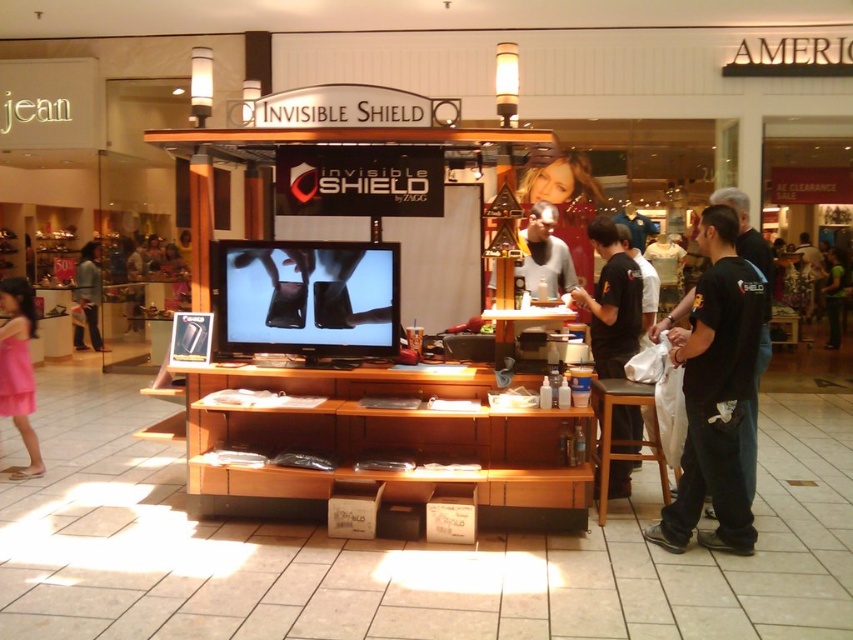
You are a customer at the INVISIBLE SHIELD kiosk. You need to sit down while discussing a product with the staff. Is there enough space between the black matte shirt at right and the brown wooden stool at lower right for you to comfortably sit?

The black matte shirt at right occupies less space than brown wooden stool at lower right. Since the brown wooden stool at lower right takes up more space, there should be sufficient room between them for you to sit comfortably.